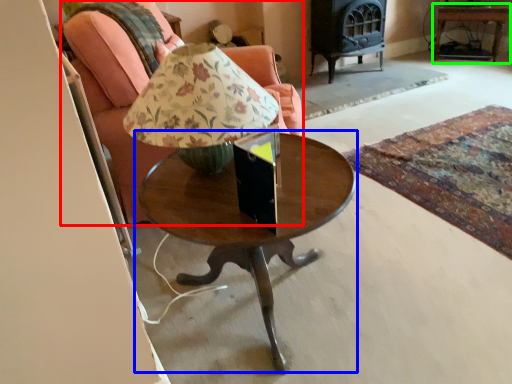
Question: Which object is positioned closest to chair (highlighted by a red box)? Select from coffee table (highlighted by a blue box) and side table (highlighted by a green box).

Choices:
 (A) coffee table
 (B) side table

Answer: (A)